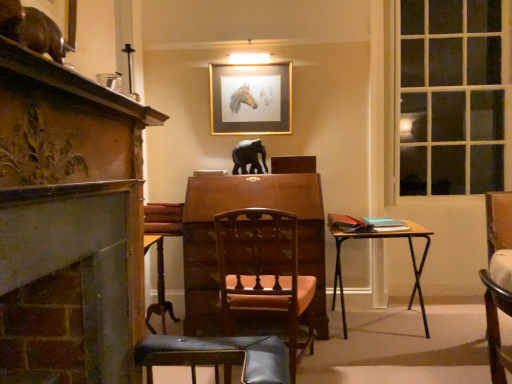
Identify the location of vacant location below wooden table at right (from a real-world perspective). [370, 332].